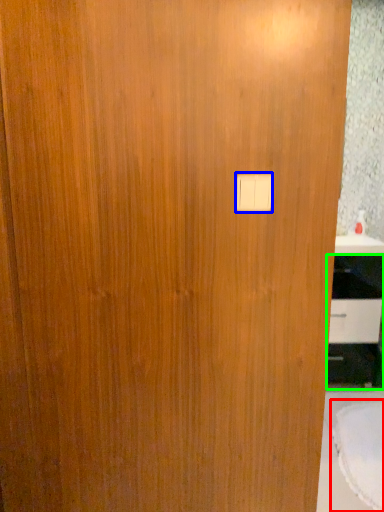
Question: Which object is the farthest from round table (highlighted by a red box)? Choose among these: light switch (highlighted by a blue box) or cabinetry (highlighted by a green box).

Choices:
 (A) light switch
 (B) cabinetry

Answer: (A)